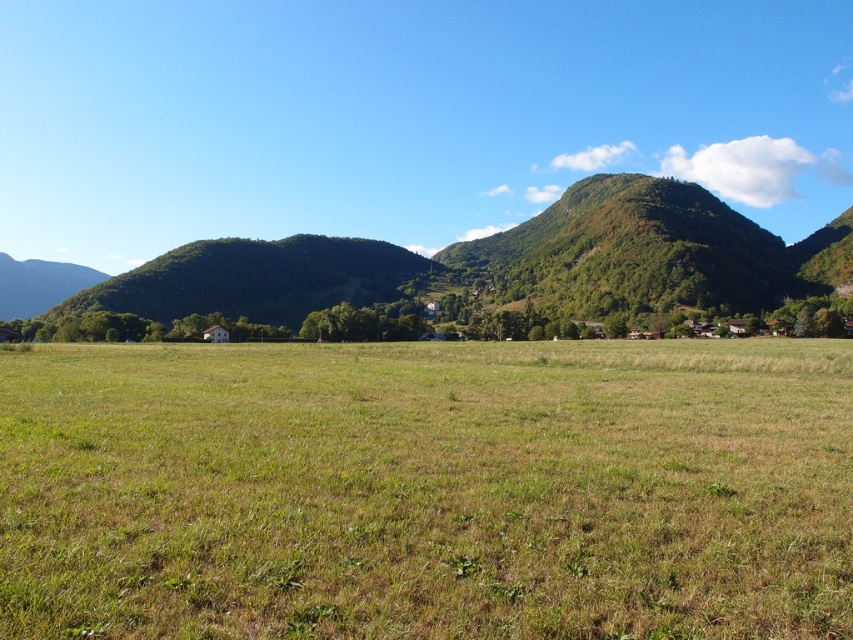
Between green grass pasture at center and green grassy hill at center, which one is positioned higher?

green grassy hill at center is higher up.

Where is `green grass pasture at center`? green grass pasture at center is located at coordinates (427, 490).

The width and height of the screenshot is (853, 640). What are the coordinates of `green grass pasture at center` in the screenshot? It's located at (427, 490).